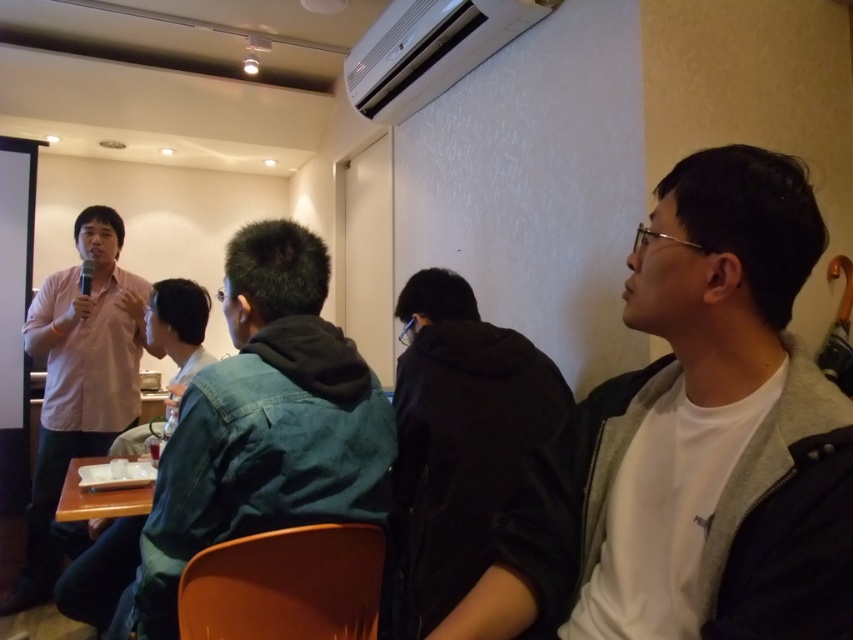
Is white matte jacket at center further to the viewer compared to pink cotton shirt at left?

No.

Is white matte jacket at center bigger than pink cotton shirt at left?

Actually, white matte jacket at center might be smaller than pink cotton shirt at left.

Image resolution: width=853 pixels, height=640 pixels. Describe the element at coordinates (721, 426) in the screenshot. I see `white matte jacket at center` at that location.

Image resolution: width=853 pixels, height=640 pixels. I want to click on white matte jacket at center, so click(x=721, y=426).

Does white plastic air conditioner at upper center come behind yellow wood tray at lower left?

Yes.

Does white plastic air conditioner at upper center have a greater height compared to yellow wood tray at lower left?

Indeed, white plastic air conditioner at upper center has a greater height compared to yellow wood tray at lower left.

Does point (367, 81) lie in front of point (65, 506)?

No, (367, 81) is behind (65, 506).

I want to click on white plastic air conditioner at upper center, so click(430, 49).

Which is below, denim jacket at left or white plastic air conditioner at upper center?

denim jacket at left is lower down.

Between denim jacket at left and white plastic air conditioner at upper center, which one has more height?

Standing taller between the two is denim jacket at left.

Who is more distant from viewer, (364,515) or (363,109)?

Point (363,109)

Identify the location of denim jacket at left. (263, 426).